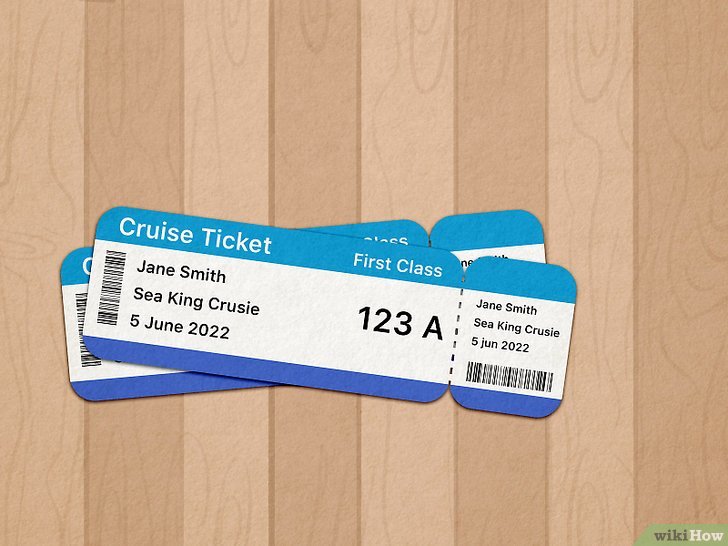
This screenshot has width=728, height=546. Identify the location of seams in wood. (82, 486), (181, 491), (274, 480), (357, 480), (462, 480), (553, 454), (632, 444).